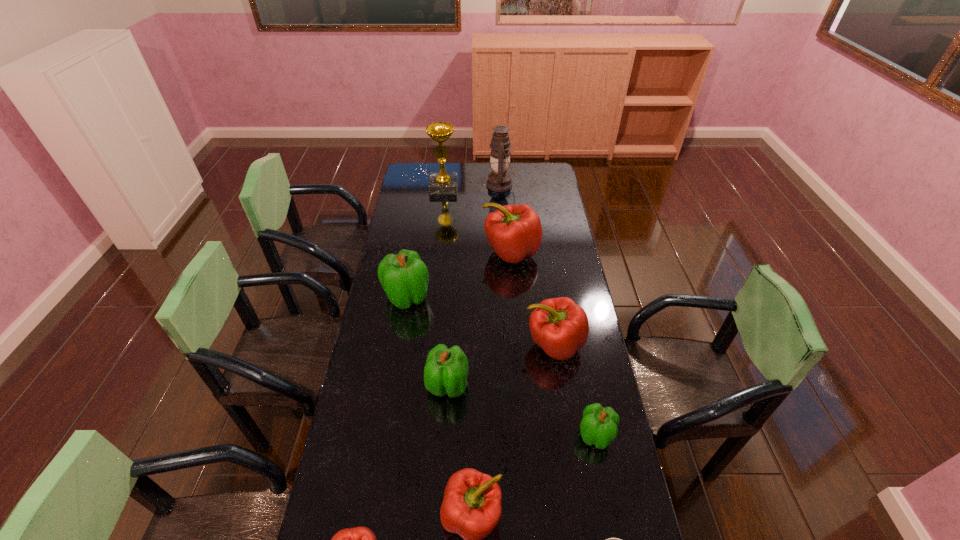
The height and width of the screenshot is (540, 960). What are the coordinates of `free space that satisfies the following two spatial constraints: 1. on the front side of the fifth farthest bell pepper; 2. on the right side of the oil lamp` in the screenshot? It's located at (516, 435).

What are the coordinates of `free space that satisfies the following two spatial constraints: 1. on the back side of the farthest pink bell pepper; 2. on the left side of the second farthest green bell pepper` in the screenshot? It's located at (456, 252).